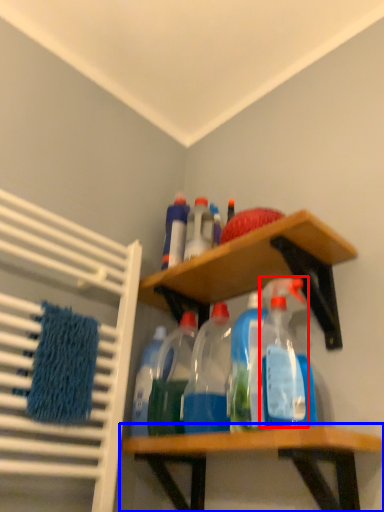
Question: Which object appears closest to the camera in this image, cleaning product (highlighted by a red box) or shelf (highlighted by a blue box)?

Choices:
 (A) cleaning product
 (B) shelf

Answer: (B)